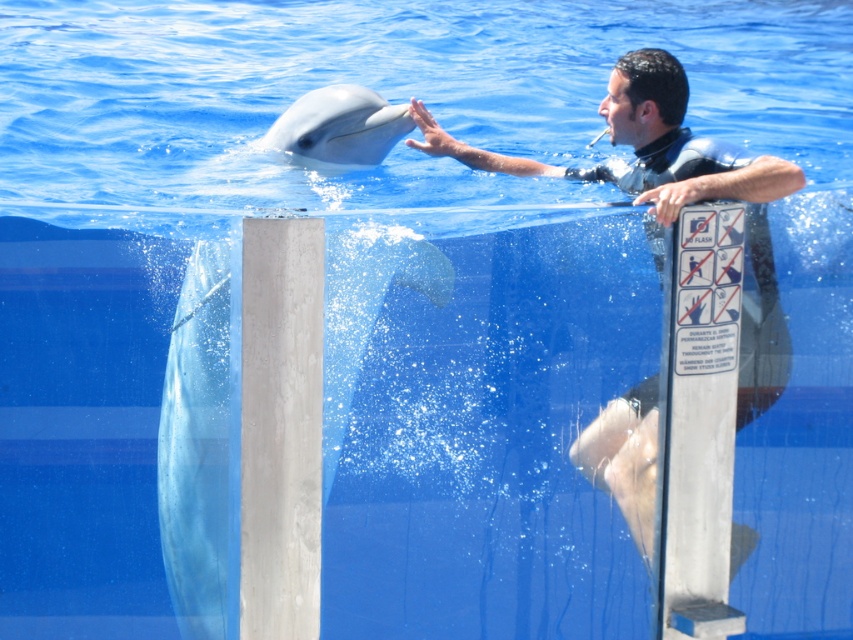
You are a marine trainer preparing to interact with the dolphin. You need to ensure the distance between the smooth black wetsuit at upper center and the white smooth dolphin at center is within a safe range of 2 meters. Is the current distance acceptable?

The distance between the smooth black wetsuit at upper center and the white smooth dolphin at center is 1.74 meters, which is within the safe range of 2 meters. Therefore, the current distance is acceptable.

You are a marine biologist observing the dolphin and the person in the image. Which object is positioned to the left of the other between the smooth black wetsuit at upper center and the white smooth dolphin at center?

The white smooth dolphin at center is positioned to the left of the smooth black wetsuit at upper center because the smooth black wetsuit at upper center is to the right of the white smooth dolphin at center.

You are a marine biologist observing the dolphin and the person in the water. From your vantage point, which object is closer to you between the smooth black wetsuit at upper center and the white smooth dolphin at center?

The smooth black wetsuit at upper center is closer to you because it is positioned in front of the white smooth dolphin at center.